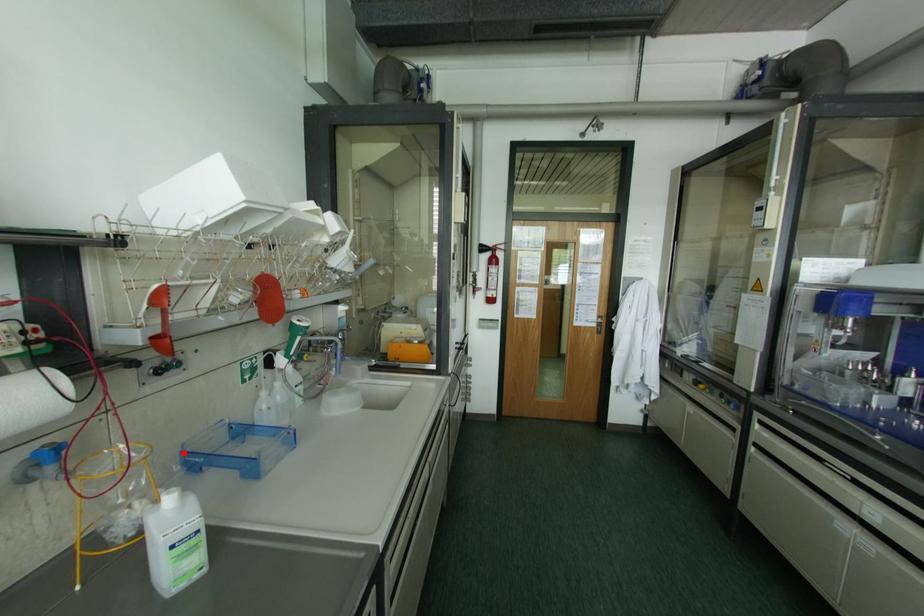
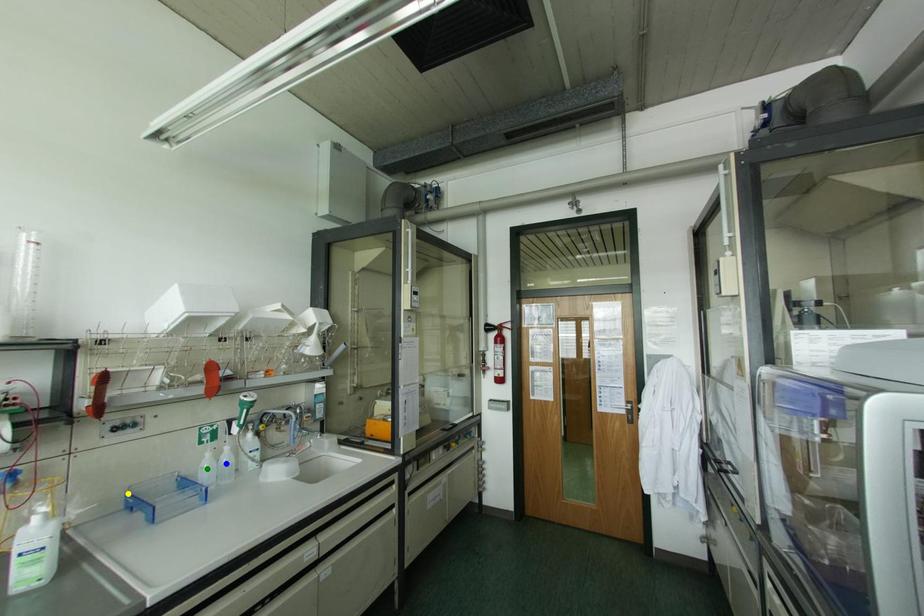
Question: I am providing you with two images of the same scene from different viewpoints. A red point is marked on the first image. You are given multiple points on the second image. Which point in image 2 represents the same 3d spot as the red point in image 1?

Choices:
 (A) green point
 (B) yellow point
 (C) blue point

Answer: (B)